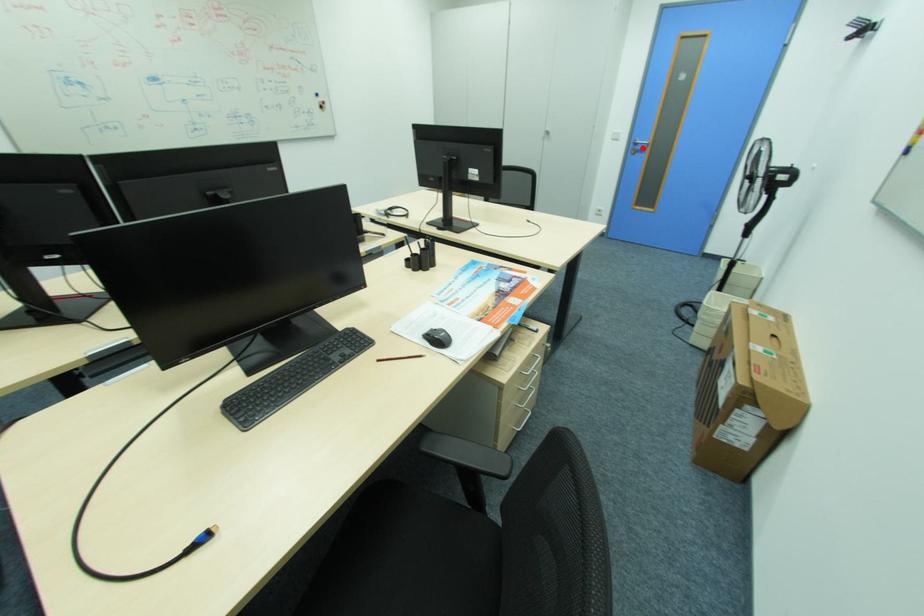
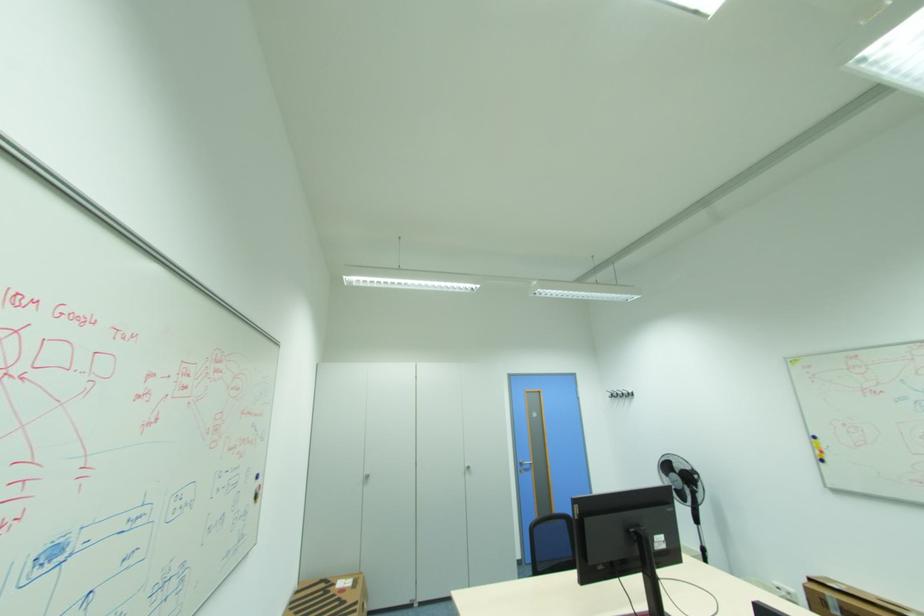
Question: A red point is marked in image1. In image2, is the corresponding 3D point closer to the camera or farther? Reply with the corresponding letter.

Choices:
 (A) The corresponding 3D point is closer.
 (B) The corresponding 3D point is farther.

Answer: (B)